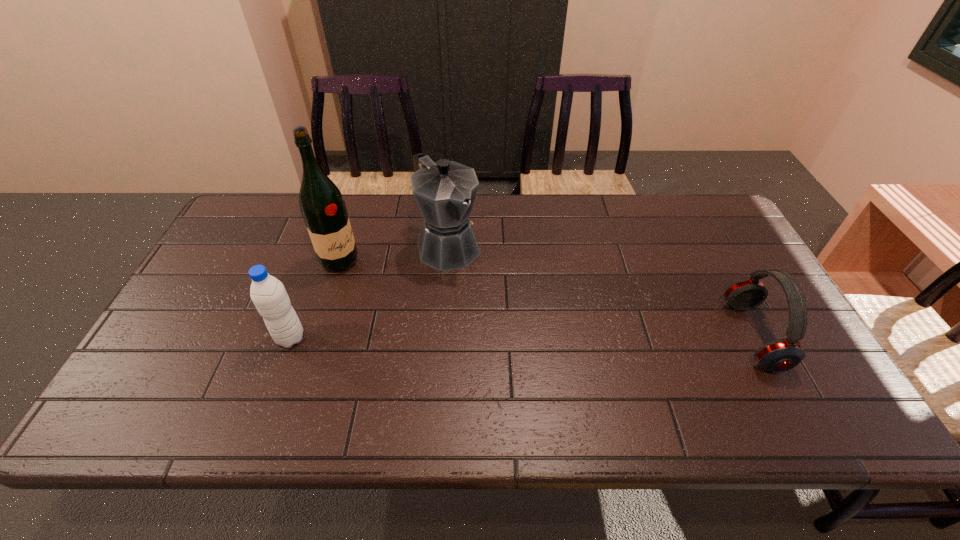
Locate an element on the screen. The width and height of the screenshot is (960, 540). vacant area located 0.080m on the front-facing side of the tallest object is located at coordinates (374, 279).

Locate an element on the screen. This screenshot has width=960, height=540. vacant space situated 0.050m at the spout of the second tallest object is located at coordinates tap(475, 278).

You are a GUI agent. You are given a task and a screenshot of the screen. Output one action in this format:
    pyautogui.click(x=<x>, y=<y>)
    Task: Click on the free location located 0.280m at the spout of the second tallest object
    The width and height of the screenshot is (960, 540).
    Given the screenshot: What is the action you would take?
    pyautogui.click(x=526, y=332)

This screenshot has width=960, height=540. What are the coordinates of `blank area located at the spout of the second tallest object` in the screenshot? It's located at (486, 288).

At what (x,y) coordinates should I click in order to perform the action: click on object that is at the far edge. Please return your answer as a coordinate pair (x, y). The width and height of the screenshot is (960, 540). Looking at the image, I should click on (445, 191).

What are the coordinates of `object at the near edge` in the screenshot? It's located at (783, 354).

Identify the location of object at the right edge. The width and height of the screenshot is (960, 540). (783, 354).

Image resolution: width=960 pixels, height=540 pixels. I want to click on object at the near right corner, so click(x=783, y=354).

Identify the location of vacant area at the far edge of the desktop. The image size is (960, 540). (511, 214).

Locate an element on the screen. vacant space at the near edge of the desktop is located at coordinates (641, 379).